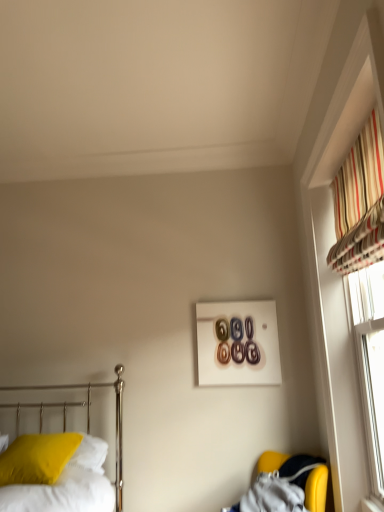
Describe the element at coordinates (287, 487) in the screenshot. Image resolution: width=384 pixels, height=512 pixels. I see `yellow fabric armchair at lower right` at that location.

This screenshot has width=384, height=512. What do you see at coordinates (37, 458) in the screenshot?
I see `matte yellow pillow at lower left` at bounding box center [37, 458].

The image size is (384, 512). Identify the location of metallic bed at left. (87, 417).

At what (x,y) coordinates should I click in order to perform the action: click on yellow fabric armchair at lower right. Please return your answer as a coordinate pair (x, y). The width and height of the screenshot is (384, 512). Looking at the image, I should click on (287, 487).

Could you tell me if yellow fabric armchair at lower right is facing striped fabric at upper right?

No.

Does yellow fabric armchair at lower right have a smaller size compared to striped fabric at upper right?

Incorrect, yellow fabric armchair at lower right is not smaller in size than striped fabric at upper right.

What are the coordinates of `armchair located behind the striped fabric at upper right` in the screenshot? It's located at (287, 487).

Can striped fabric at upper right be found inside yellow fabric armchair at lower right?

No, striped fabric at upper right is located outside of yellow fabric armchair at lower right.

From the image's perspective, is striped fabric at upper right over metallic bed at left?

Yes, from the image's perspective, striped fabric at upper right is on top of metallic bed at left.

This screenshot has height=512, width=384. I want to click on curtain on the right of the metallic bed at left, so click(x=360, y=202).

Is striped fabric at upper right bigger or smaller than metallic bed at left?

Considering their sizes, striped fabric at upper right takes up less space than metallic bed at left.

Are striped fabric at upper right and metallic bed at left located far from each other?

That's right, there is a large distance between striped fabric at upper right and metallic bed at left.

Is metallic bed at left smaller than matte yellow pillow at lower left?

No.

From a real-world perspective, is metallic bed at left positioned over matte yellow pillow at lower left based on gravity?

Yes, from a real-world perspective, metallic bed at left is over matte yellow pillow at lower left

Which object is positioned more to the right, metallic bed at left or matte yellow pillow at lower left?

matte yellow pillow at lower left is more to the right.

From the image's perspective, which is below, metallic bed at left or matte yellow pillow at lower left?

matte yellow pillow at lower left.

How far apart are matte yellow pillow at lower left and yellow fabric armchair at lower right?

A distance of 4.29 feet exists between matte yellow pillow at lower left and yellow fabric armchair at lower right.

Is matte yellow pillow at lower left in front of or behind yellow fabric armchair at lower right in the image?

matte yellow pillow at lower left is behind yellow fabric armchair at lower right.

Between matte yellow pillow at lower left and yellow fabric armchair at lower right, which one has less height?

Standing shorter between the two is matte yellow pillow at lower left.

Is matte yellow pillow at lower left placed right next to yellow fabric armchair at lower right?

No.

Are white glossy picture frame at center and metallic bed at left located far from each other?

Actually, white glossy picture frame at center and metallic bed at left are a little close together.

How many degrees apart are the facing directions of white glossy picture frame at center and metallic bed at left?

1.14 degrees.

Does white glossy picture frame at center appear on the left side of metallic bed at left?

In fact, white glossy picture frame at center is to the right of metallic bed at left.

Which of these two, metallic bed at left or white glossy picture frame at center, is bigger?

With larger size is metallic bed at left.

Can you confirm if metallic bed at left is taller than white glossy picture frame at center?

Yes.

Is point (119, 441) farther from viewer compared to point (223, 342)?

No, it is not.

From the image's perspective, relative to white glossy picture frame at center, is metallic bed at left above or below?

Based on their image positions, metallic bed at left is located beneath white glossy picture frame at center.

In the scene shown: Are matte yellow pillow at lower left and white glossy picture frame at center far apart?

Indeed, matte yellow pillow at lower left is not near white glossy picture frame at center.

Consider the image. Does matte yellow pillow at lower left have a smaller size compared to white glossy picture frame at center?

No, matte yellow pillow at lower left is not smaller than white glossy picture frame at center.

I want to click on pillow in front of the white glossy picture frame at center, so click(37, 458).

You are a GUI agent. You are given a task and a screenshot of the screen. Output one action in this format:
    pyautogui.click(x=<x>, y=<y>)
    Task: Click on the armchair lying behind the striped fabric at upper right
    
    Given the screenshot: What is the action you would take?
    pyautogui.click(x=287, y=487)

Image resolution: width=384 pixels, height=512 pixels. Find the location of `bed below the striped fabric at upper right (from the image's perspective)`. bed below the striped fabric at upper right (from the image's perspective) is located at coordinates (87, 417).

Based on their spatial positions, is striped fabric at upper right or yellow fabric armchair at lower right closer to metallic bed at left?

yellow fabric armchair at lower right is closer to metallic bed at left.

Estimate the real-world distances between objects in this image. Which object is further from yellow fabric armchair at lower right, matte yellow pillow at lower left or white glossy picture frame at center?

matte yellow pillow at lower left.

When comparing their distances from white glossy picture frame at center, does matte yellow pillow at lower left or striped fabric at upper right seem further?

matte yellow pillow at lower left lies further to white glossy picture frame at center than the other object.

When comparing their distances from metallic bed at left, does white glossy picture frame at center or matte yellow pillow at lower left seem further?

white glossy picture frame at center.

Estimate the real-world distances between objects in this image. Which object is further from yellow fabric armchair at lower right, metallic bed at left or striped fabric at upper right?

striped fabric at upper right lies further to yellow fabric armchair at lower right than the other object.

Based on their spatial positions, is matte yellow pillow at lower left or yellow fabric armchair at lower right further from striped fabric at upper right?

matte yellow pillow at lower left is positioned further to the anchor striped fabric at upper right.

Considering their positions, is striped fabric at upper right positioned closer to matte yellow pillow at lower left than yellow fabric armchair at lower right?

yellow fabric armchair at lower right.

Based on their spatial positions, is matte yellow pillow at lower left or white glossy picture frame at center closer to metallic bed at left?

Among the two, matte yellow pillow at lower left is located nearer to metallic bed at left.

Where is `curtain positioned between metallic bed at left and white glossy picture frame at center from near to far`? This screenshot has width=384, height=512. curtain positioned between metallic bed at left and white glossy picture frame at center from near to far is located at coordinates (360, 202).

Identify the location of picture frame between matte yellow pillow at lower left and striped fabric at upper right from left to right. (238, 343).

This screenshot has height=512, width=384. I want to click on pillow between metallic bed at left and yellow fabric armchair at lower right from left to right, so click(37, 458).

This screenshot has height=512, width=384. Find the location of `armchair situated between matte yellow pillow at lower left and striped fabric at upper right from left to right`. armchair situated between matte yellow pillow at lower left and striped fabric at upper right from left to right is located at coordinates (287, 487).